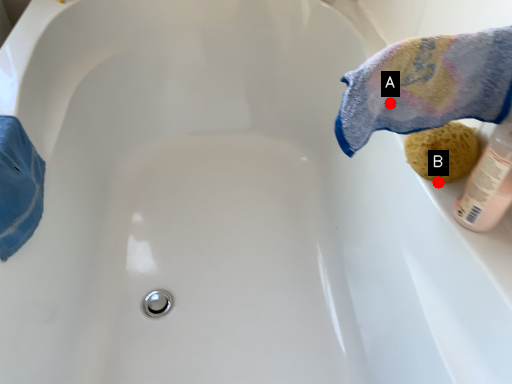
Question: Two points are circled on the image, labeled by A and B beside each circle. Which point appears farthest from the camera in this image?

Choices:
 (A) A is further
 (B) B is further

Answer: (B)